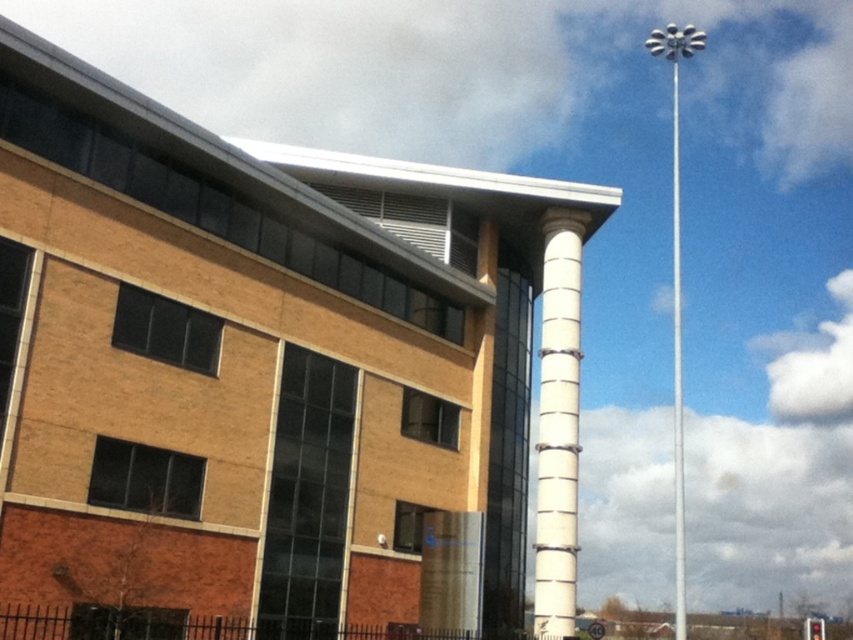
You are a delivery person trying to park your 1.2 meter wide delivery cart between the white glossy column at center and the white metallic pole at right. Based on the scene, can you fit your cart in the space between them?

The white glossy column at center occupies less space than white metallic pole at right, so there might be enough space between them to park the cart. However, since the exact distance isn not provided, it is recommended to measure the gap before attempting to park.

You are a delivery person trying to navigate to the entrance of the building. You see the white glossy column at center and the white metallic pole at right. Which object is closer to the entrance of the building?

The white glossy column at center is closer to the entrance of the building because it is positioned under the white metallic pole at right, indicating it is in front of the pole and thus nearer to the entrance.